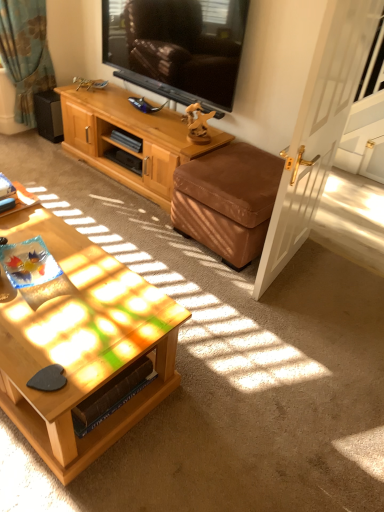
The image size is (384, 512). I want to click on free space in front of black matte speaker at left, so click(46, 145).